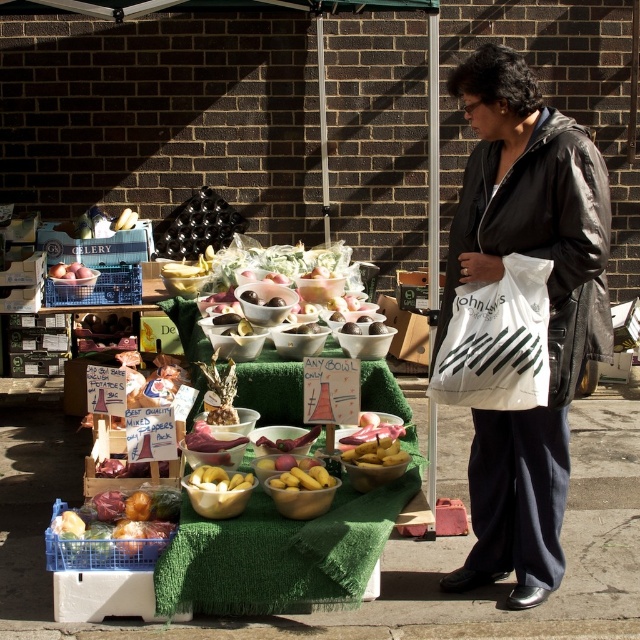
Between point (582, 349) and point (60, 278), which one is positioned in front?

Point (582, 349) is in front.

Does point (520, 125) lie in front of point (60, 262)?

Yes.

Locate an element on the screen. The height and width of the screenshot is (640, 640). shiny black jacket at right is located at coordinates (548, 308).

In the scene shown: Who is more distant from viewer, [579,200] or [500,330]?

The point [579,200] is more distant.

The image size is (640, 640). What do you see at coordinates (548, 308) in the screenshot? I see `shiny black jacket at right` at bounding box center [548, 308].

Is point (468, 97) positioned after point (490, 394)?

Yes, point (468, 97) is farther from viewer.

Locate an element on the screen. shiny black jacket at right is located at coordinates (548, 308).

Does white plastic bag at center have a lesser height compared to shiny plastic bag of mixed vegetables at lower left?

No, white plastic bag at center is not shorter than shiny plastic bag of mixed vegetables at lower left.

Who is higher up, white plastic bag at center or shiny plastic bag of mixed vegetables at lower left?

white plastic bag at center is above.

Between point (472, 326) and point (106, 492), which one is positioned behind?

The point (106, 492) is more distant.

Locate an element on the screen. This screenshot has width=640, height=640. white plastic bag at center is located at coordinates (497, 340).